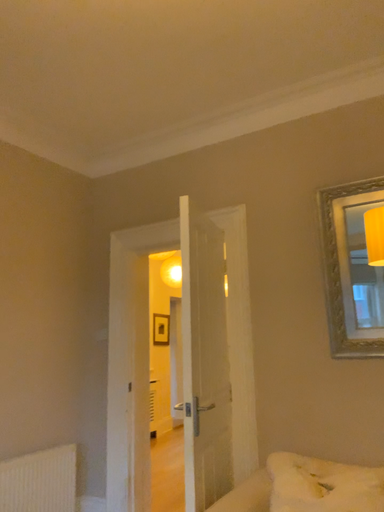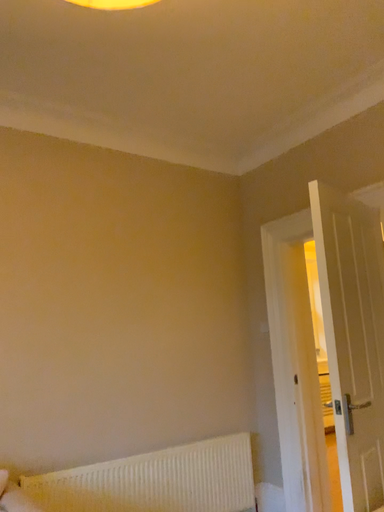
Question: Which way did the camera rotate in the video?

Choices:
 (A) rotated left
 (B) rotated right

Answer: (A)